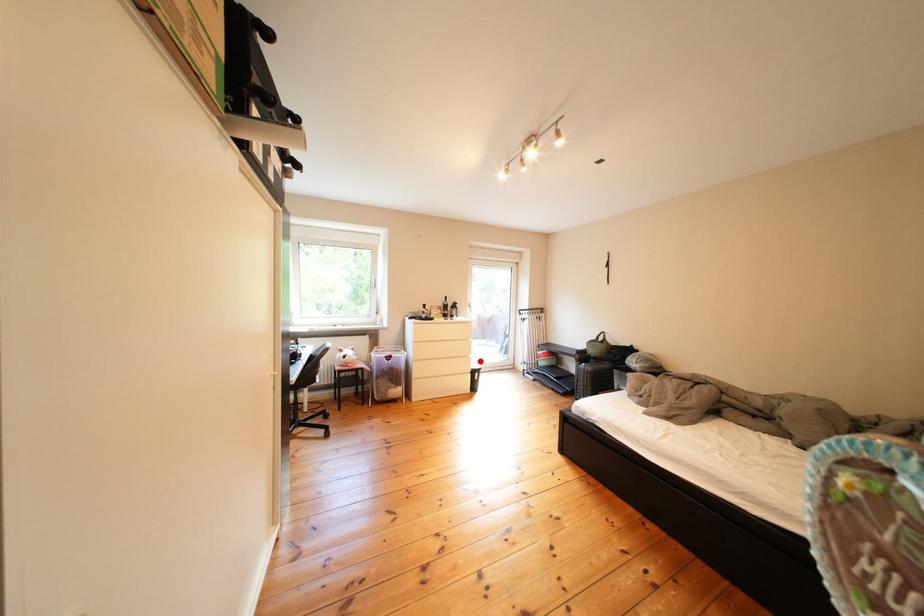
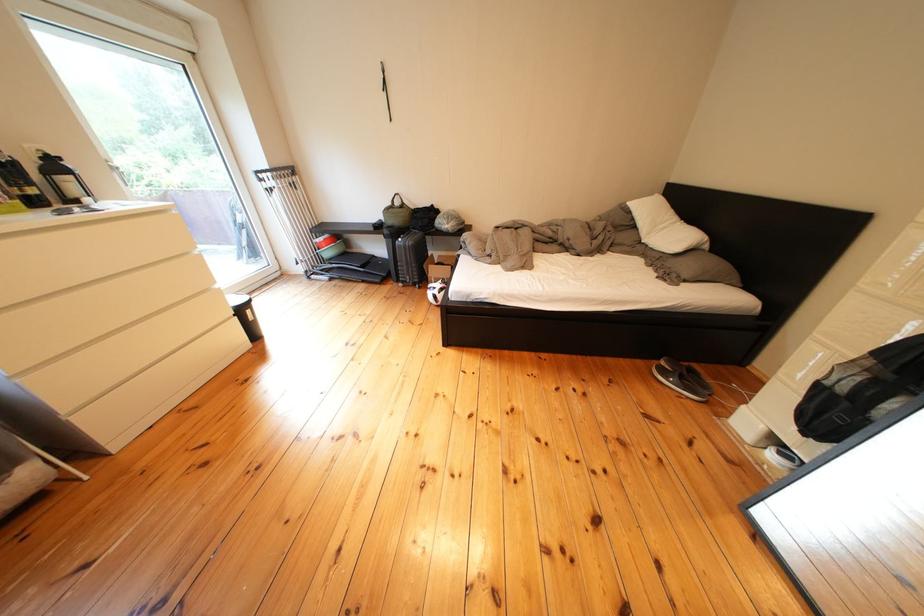
Question: A red point is marked in image1. In image2, is the corresponding 3D point closer to the camera or farther? Reply with the corresponding letter.

Choices:
 (A) The corresponding 3D point is closer.
 (B) The corresponding 3D point is farther.

Answer: (A)